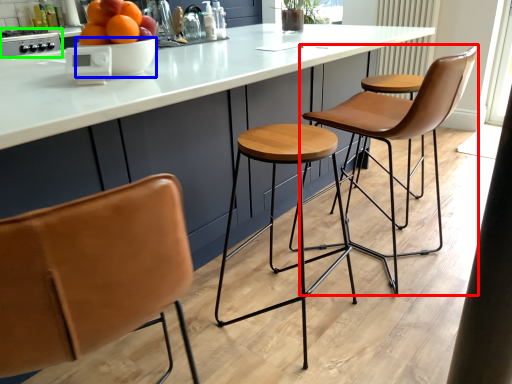
Question: Estimate the real-world distances between objects in this image. Which object is closer to chair (highlighted by a red box), bowl (highlighted by a blue box) or appliance (highlighted by a green box)?

Choices:
 (A) bowl
 (B) appliance

Answer: (A)